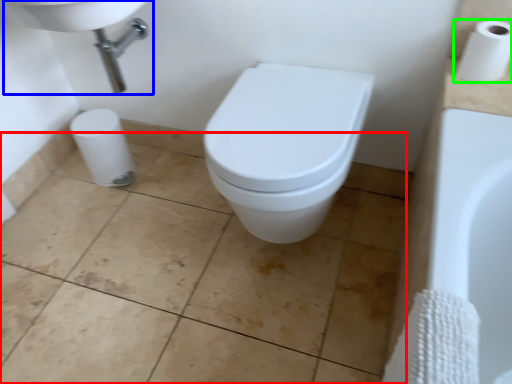
Question: Which object is the farthest from ceramic tile (highlighted by a red box)? Choose among these: sink (highlighted by a blue box) or toilet paper (highlighted by a green box).

Choices:
 (A) sink
 (B) toilet paper

Answer: (B)